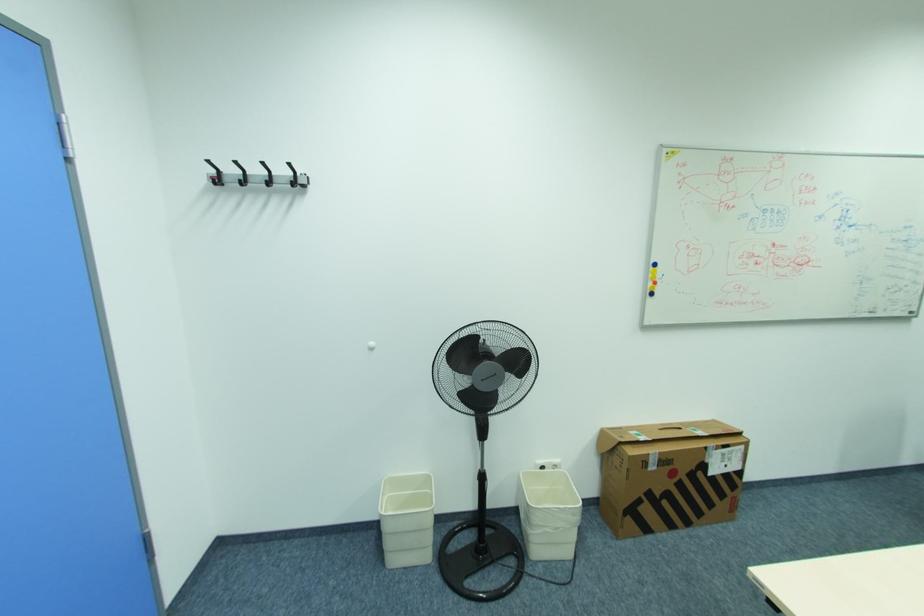
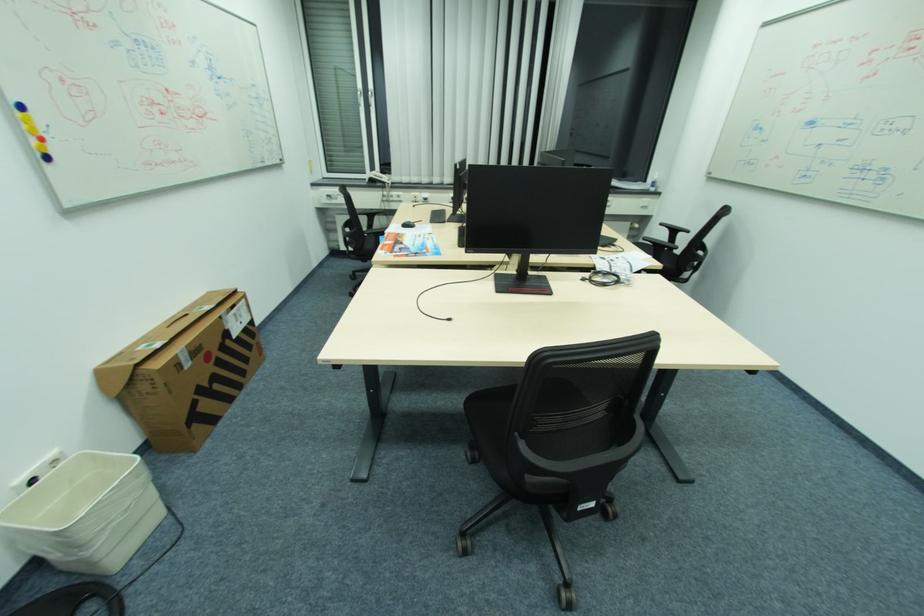
The point at (657, 269) is marked in the first image. Where is the corresponding point in the second image?

(21, 114)